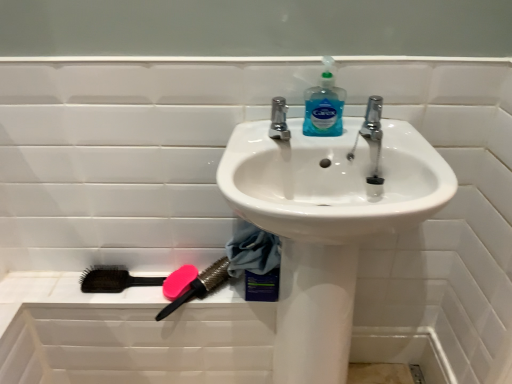
Question: Is pink rubber soap at lower left with pink rubber brush at lower left, which is the second brush in left-to-right order?

Choices:
 (A) yes
 (B) no

Answer: (A)

Question: From the image's perspective, is pink rubber soap at lower left located above pink rubber brush at lower left, which is the second brush in left-to-right order?

Choices:
 (A) yes
 (B) no

Answer: (A)

Question: From the image's perspective, is pink rubber soap at lower left beneath pink rubber brush at lower left, which appears as the 1th brush when viewed from the right?

Choices:
 (A) yes
 (B) no

Answer: (B)

Question: Is pink rubber soap at lower left positioned behind pink rubber brush at lower left, which appears as the 1th brush when viewed from the right?

Choices:
 (A) no
 (B) yes

Answer: (B)

Question: Considering the relative sizes of pink rubber soap at lower left and pink rubber brush at lower left, which appears as the 1th brush when viewed from the right, in the image provided, is pink rubber soap at lower left shorter than pink rubber brush at lower left, which appears as the 1th brush when viewed from the right,?

Choices:
 (A) no
 (B) yes

Answer: (B)

Question: Would you say black plastic brush at lower left, arranged as the second brush when viewed from the right, is to the left or to the right of pink rubber brush at lower left, which appears as the 1th brush when viewed from the right, in the picture?

Choices:
 (A) right
 (B) left

Answer: (B)

Question: From their relative heights in the image, would you say black plastic brush at lower left, which is counted as the first brush, starting from the left, is taller or shorter than pink rubber brush at lower left, which appears as the 1th brush when viewed from the right?

Choices:
 (A) tall
 (B) short

Answer: (B)

Question: From a real-world perspective, is black plastic brush at lower left, which is counted as the first brush, starting from the left, positioned above or below pink rubber brush at lower left, which appears as the 1th brush when viewed from the right?

Choices:
 (A) below
 (B) above

Answer: (A)

Question: Choose the correct answer: Is black plastic brush at lower left, arranged as the second brush when viewed from the right, inside pink rubber brush at lower left, which is the second brush in left-to-right order, or outside it?

Choices:
 (A) inside
 (B) outside

Answer: (B)

Question: Is pink rubber soap at lower left wider or thinner than white glossy sink at center?

Choices:
 (A) wide
 (B) thin

Answer: (B)

Question: In terms of size, does pink rubber soap at lower left appear bigger or smaller than white glossy sink at center?

Choices:
 (A) big
 (B) small

Answer: (B)

Question: From the image's perspective, is pink rubber soap at lower left positioned above or below white glossy sink at center?

Choices:
 (A) above
 (B) below

Answer: (A)

Question: Would you say pink rubber soap at lower left is to the left or to the right of white glossy sink at center in the picture?

Choices:
 (A) right
 (B) left

Answer: (B)

Question: From a real-world perspective, is pink rubber brush at lower left, which is the second brush in left-to-right order, physically located above or below chrome metallic faucet at upper center?

Choices:
 (A) below
 (B) above

Answer: (A)

Question: In the image, is pink rubber brush at lower left, which is the second brush in left-to-right order, positioned in front of or behind chrome metallic faucet at upper center?

Choices:
 (A) behind
 (B) front

Answer: (A)